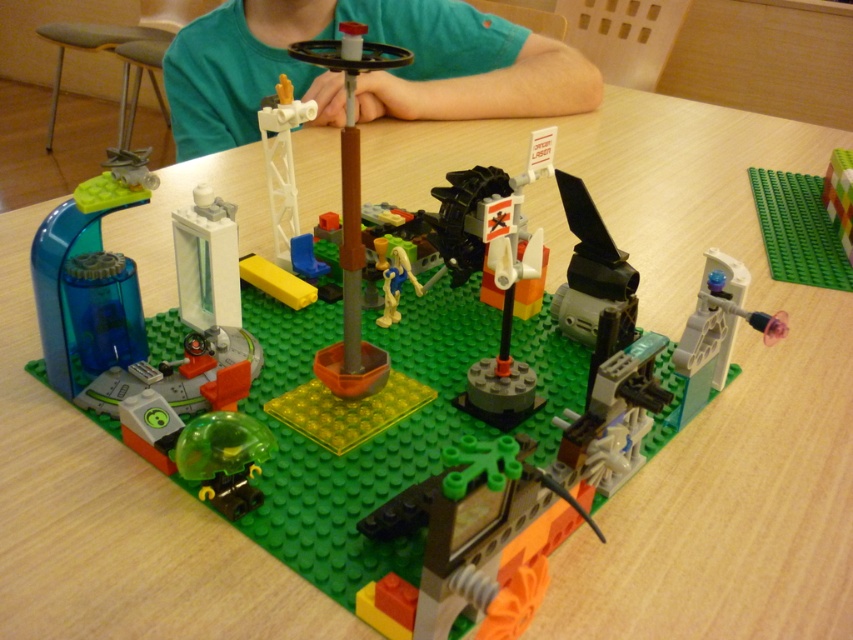
Is green matte shirt at upper center thinner than yellow matte figure at center?

No.

What are the coordinates of `green matte shirt at upper center` in the screenshot? It's located at pos(366,74).